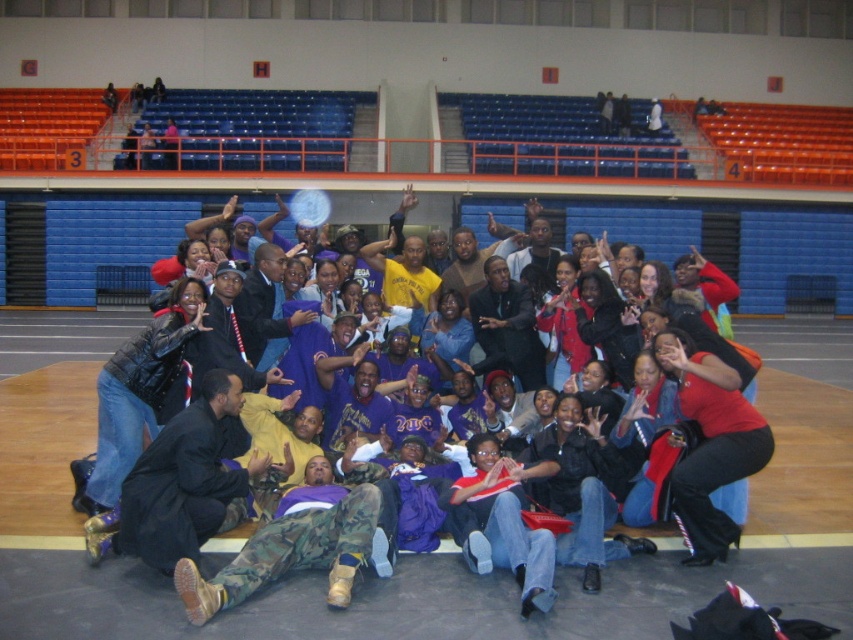
You are a photographer standing at the front of the gymnasium. You want to take a photo that includes both the black matte jacket at lower left and the dark suit at center. Can you fit both subjects into your camera frame if your camera has a 2.5 meter field of view?

The black matte jacket at lower left is 2.68 meters from the dark suit at center, which exceeds the camera frame of 2.5 meters. Therefore, both subjects cannot be captured in the same frame.

You are standing at the point marked by the coordinate point at point [218,502]. You want to throw a ball to your friend who is standing 5.80 meters away from you. Can you estimate how far you need to throw the ball?

The distance between you and your friend is exactly 5.80 meters, so you need to throw the ball 5.80 meters to reach them.